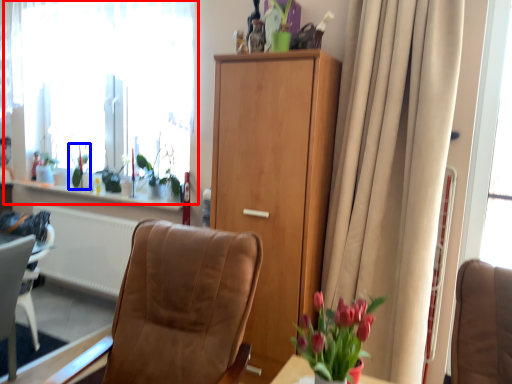
Question: Which object appears farthest to the camera in this image, window (highlighted by a red box) or plant (highlighted by a blue box)?

Choices:
 (A) window
 (B) plant

Answer: (B)